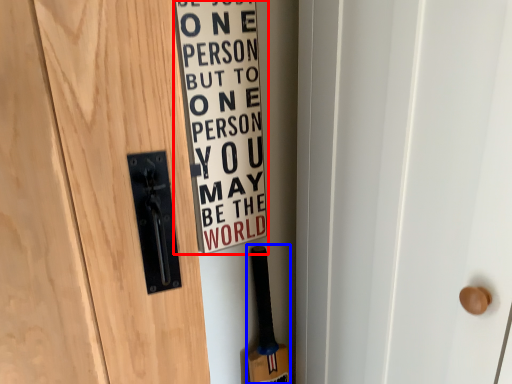
Question: Which object is further to the camera taking this photo, warning sign (highlighted by a red box) or baseball bat (highlighted by a blue box)?

Choices:
 (A) warning sign
 (B) baseball bat

Answer: (B)